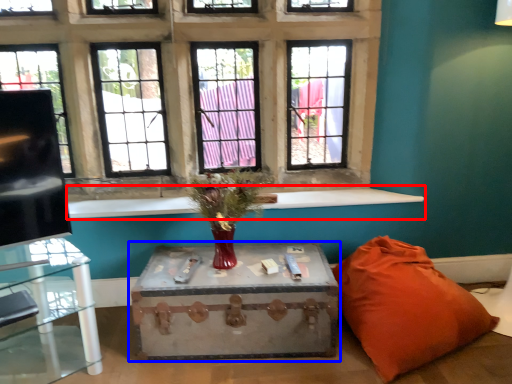
Question: Among these objects, which one is farthest to the camera, window sill (highlighted by a red box) or table (highlighted by a blue box)?

Choices:
 (A) window sill
 (B) table

Answer: (A)